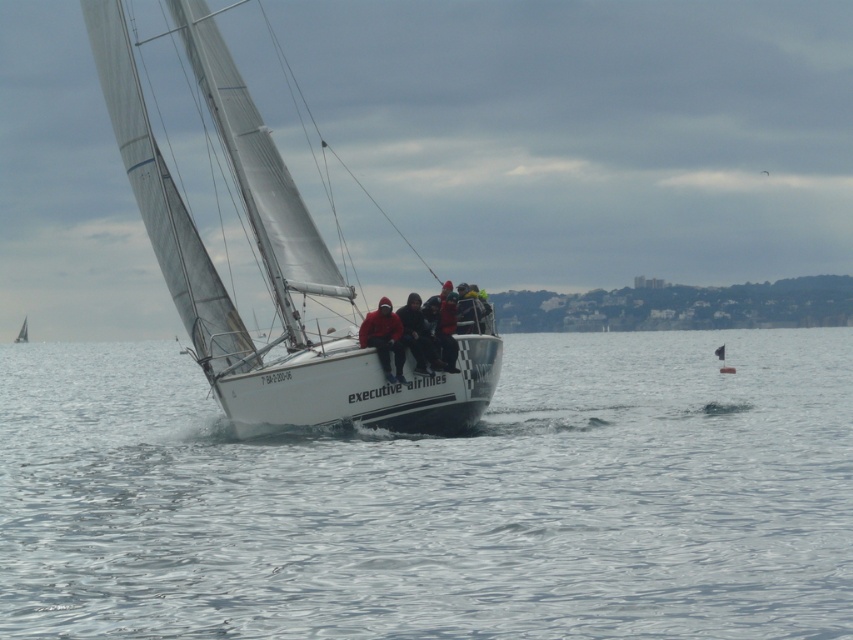
Who is shorter, clear water at sailboat front or white sailboat at center?

clear water at sailboat front is shorter.

Is clear water at sailboat front smaller than white sailboat at center?

No, clear water at sailboat front is not smaller than white sailboat at center.

Where is `clear water at sailboat front`? This screenshot has width=853, height=640. clear water at sailboat front is located at coordinates (438, 499).

Is white matte sailboat at center shorter than red fleece jackets at center?

In fact, white matte sailboat at center may be taller than red fleece jackets at center.

Who is more distant from viewer, (252, 355) or (410, 326)?

→ The point (252, 355) is more distant.

Between point (165, 253) and point (390, 324), which one is positioned behind?

Positioned behind is point (165, 253).

The height and width of the screenshot is (640, 853). Identify the location of white matte sailboat at center. (263, 260).

Who is more distant from viewer, [664,348] or [415,336]?

Positioned behind is point [664,348].

Can you confirm if clear water at sailboat front is wider than red fleece jackets at center?

Yes, clear water at sailboat front is wider than red fleece jackets at center.

Is point (148, 563) farther from viewer compared to point (389, 346)?

No, it is not.

Where is `clear water at sailboat front`? The width and height of the screenshot is (853, 640). clear water at sailboat front is located at coordinates (438, 499).